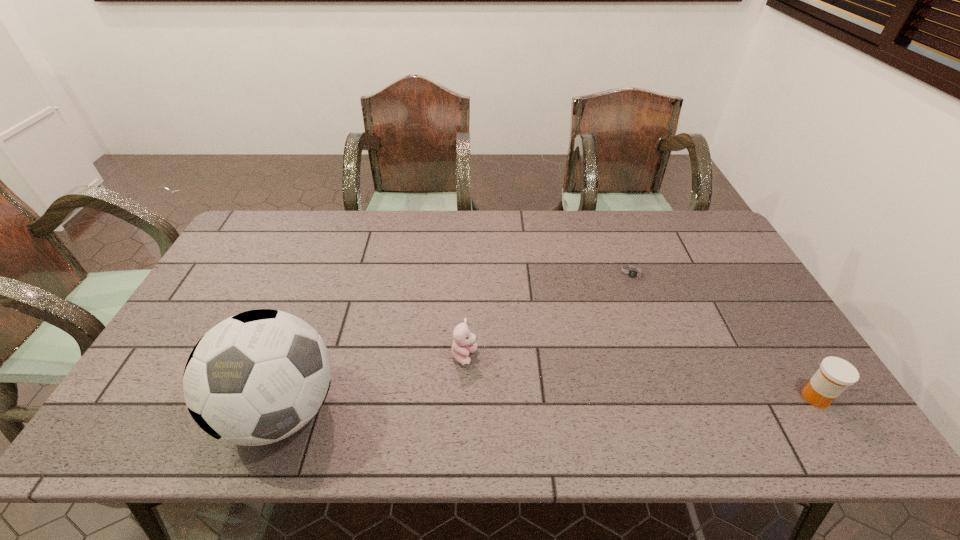
Point out which object is positioned as the second nearest to the rightmost object. Please provide its 2D coordinates. Your answer should be formatted as a tuple, i.e. [(x, y)], where the tuple contains the x and y coordinates of a point satisfying the conditions above.

[(464, 343)]